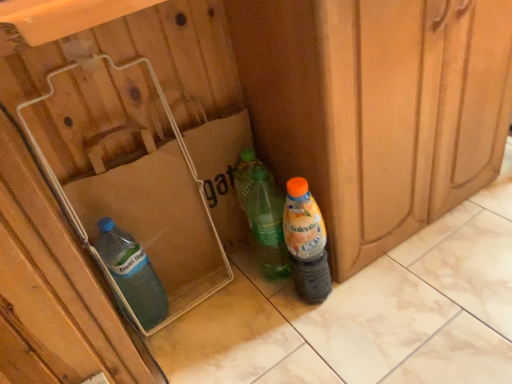
Question: Is transparent plastic bottle at lower left, which appears as the second bottle when viewed from the right, looking in the opposite direction of translucent plastic bottle at lower right, the 1th bottle in the right-to-left sequence?

Choices:
 (A) yes
 (B) no

Answer: (B)

Question: Does transparent plastic bottle at lower left, which appears as the second bottle when viewed from the right, come behind translucent plastic bottle at lower right, the 1th bottle in the right-to-left sequence?

Choices:
 (A) yes
 (B) no

Answer: (A)

Question: From a real-world perspective, is transparent plastic bottle at lower left, which appears as the second bottle when viewed from the right, on top of translucent plastic bottle at lower right, the second bottle positioned from the left?

Choices:
 (A) yes
 (B) no

Answer: (B)

Question: Is transparent plastic bottle at lower left, the 1th bottle positioned from the left, not inside translucent plastic bottle at lower right, the 1th bottle in the right-to-left sequence?

Choices:
 (A) no
 (B) yes

Answer: (B)

Question: Would you say transparent plastic bottle at lower left, which appears as the second bottle when viewed from the right, contains translucent plastic bottle at lower right, the 1th bottle in the right-to-left sequence?

Choices:
 (A) yes
 (B) no

Answer: (B)

Question: Is transparent plastic bottle at lower left, the 1th bottle positioned from the left, not close to translucent plastic bottle at lower right, the 1th bottle in the right-to-left sequence?

Choices:
 (A) yes
 (B) no

Answer: (B)

Question: Is transparent plastic bottle at lower left, the 1th bottle positioned from the left, wider than translucent plastic box at lower left?

Choices:
 (A) no
 (B) yes

Answer: (A)

Question: Is transparent plastic bottle at lower left, the 1th bottle positioned from the left, completely or partially outside of translucent plastic box at lower left?

Choices:
 (A) no
 (B) yes

Answer: (A)

Question: Is transparent plastic bottle at lower left, the 1th bottle positioned from the left, closer to the viewer compared to translucent plastic box at lower left?

Choices:
 (A) yes
 (B) no

Answer: (B)

Question: Is transparent plastic bottle at lower left, the 1th bottle positioned from the left, at the right side of translucent plastic box at lower left?

Choices:
 (A) no
 (B) yes

Answer: (A)

Question: Is transparent plastic bottle at lower left, which appears as the second bottle when viewed from the right, taller than translucent plastic box at lower left?

Choices:
 (A) yes
 (B) no

Answer: (B)

Question: Considering the relative sizes of transparent plastic bottle at lower left, the 1th bottle positioned from the left, and translucent plastic box at lower left in the image provided, is transparent plastic bottle at lower left, the 1th bottle positioned from the left, shorter than translucent plastic box at lower left?

Choices:
 (A) no
 (B) yes

Answer: (B)

Question: Can you confirm if translucent plastic bottle at lower right, the second bottle positioned from the left, is thinner than transparent plastic bottle at lower left, the 1th bottle positioned from the left?

Choices:
 (A) no
 (B) yes

Answer: (B)